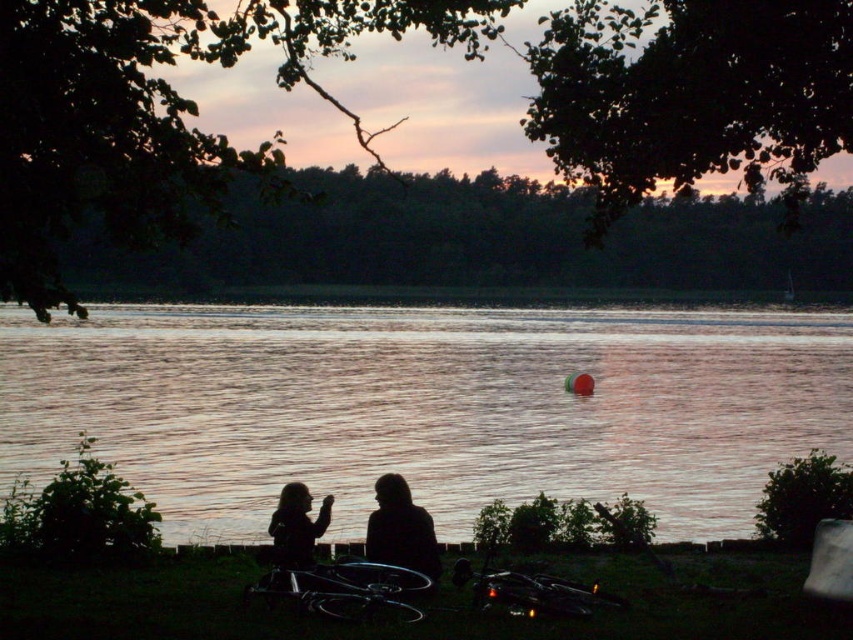
Which of these two, silhouette figure at center or silhouette fabric person at center, stands taller?

silhouette figure at center is taller.

Is silhouette figure at center below silhouette fabric person at center?

No.

Which is in front, point (421, 572) or point (316, 536)?

Positioned in front is point (421, 572).

Identify the location of silhouette figure at center. This screenshot has height=640, width=853. (399, 529).

Can you confirm if reflective water at center is wider than silhouette fabric person at center?

Correct, the width of reflective water at center exceeds that of silhouette fabric person at center.

Between reflective water at center and silhouette fabric person at center, which one appears on the left side from the viewer's perspective?

From the viewer's perspective, reflective water at center appears more on the left side.

Does point (64, 320) come in front of point (323, 502)?

No, (64, 320) is further to viewer.

Identify the location of reflective water at center. (425, 406).

Looking at this image, can you confirm if reflective water at center is shorter than silhouette figure at center?

No, reflective water at center is not shorter than silhouette figure at center.

What do you see at coordinates (425, 406) in the screenshot? This screenshot has height=640, width=853. I see `reflective water at center` at bounding box center [425, 406].

What do you see at coordinates (425, 406) in the screenshot? This screenshot has height=640, width=853. I see `reflective water at center` at bounding box center [425, 406].

What are the coordinates of `reflective water at center` in the screenshot? It's located at pyautogui.click(x=425, y=406).